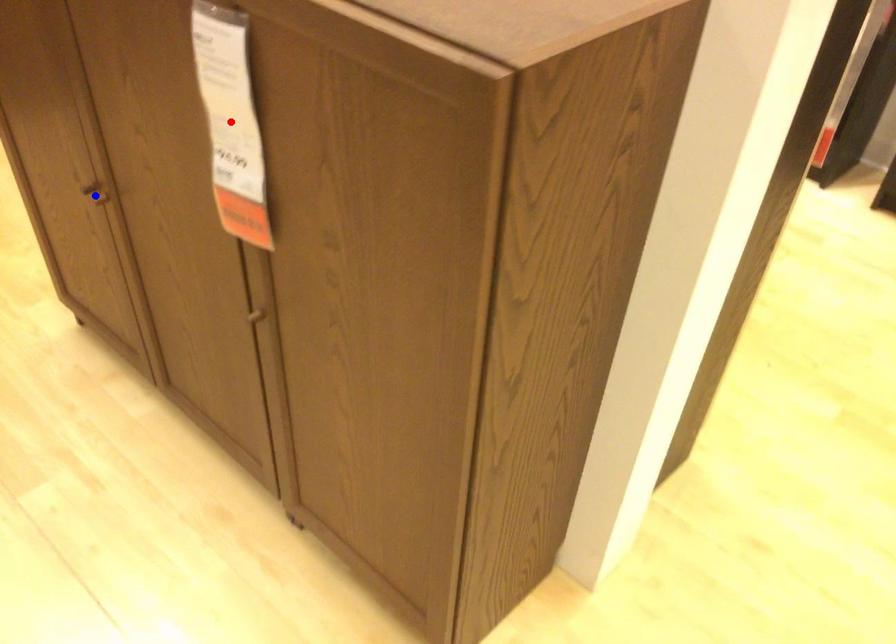
Question: Which of the two points in the image is closer to the camera?

Choices:
 (A) Blue point is closer.
 (B) Red point is closer.

Answer: (B)